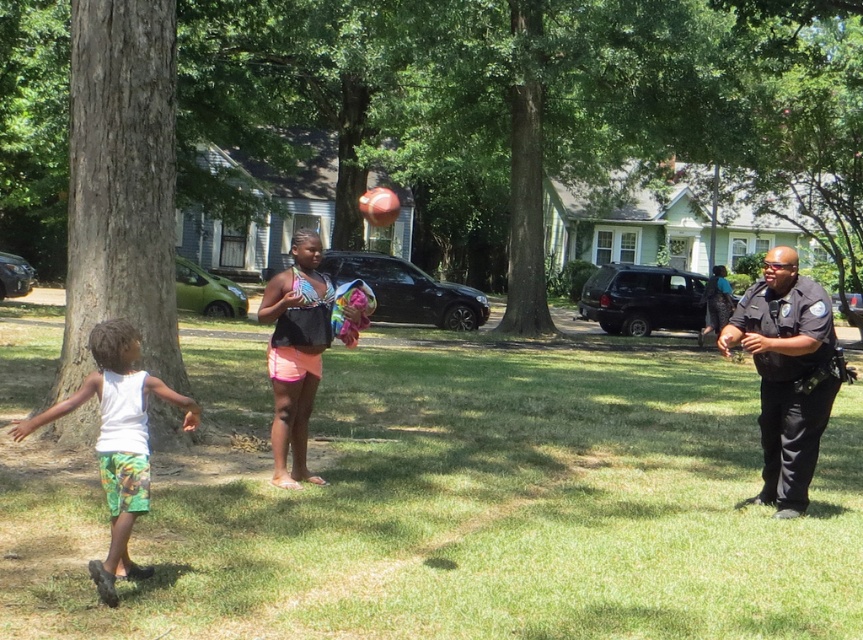
Question: Estimate the real-world distances between objects in this image. Which object is closer to the black uniform at right?

Choices:
 (A) brown rough tree at center
 (B) brown rough tree at left
 (C) white cotton tank top at left

Answer: (C)

Question: Is white cotton tank top at left smaller than neon pink shorts at center?

Choices:
 (A) no
 (B) yes

Answer: (B)

Question: Does brown rough tree at left appear on the right side of white cotton tank top at left?

Choices:
 (A) no
 (B) yes

Answer: (A)

Question: Can you confirm if brown rough tree at center is thinner than black uniform at right?

Choices:
 (A) yes
 (B) no

Answer: (B)

Question: Which point is farther to the camera?

Choices:
 (A) black uniform at right
 (B) white cotton tank top at left
 (C) brown rough tree at center
 (D) brown rough tree at left

Answer: (C)

Question: Which of these objects is positioned closest to the white cotton tank top at left?

Choices:
 (A) brown rough tree at left
 (B) black uniform at right
 (C) neon pink shorts at center

Answer: (C)